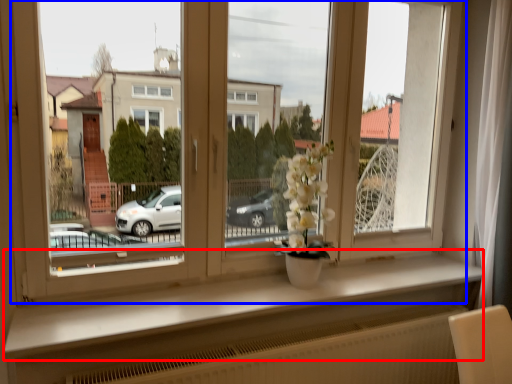
Question: Among these objects, which one is nearest to the camera, window sill (highlighted by a red box) or window (highlighted by a blue box)?

Choices:
 (A) window sill
 (B) window

Answer: (A)